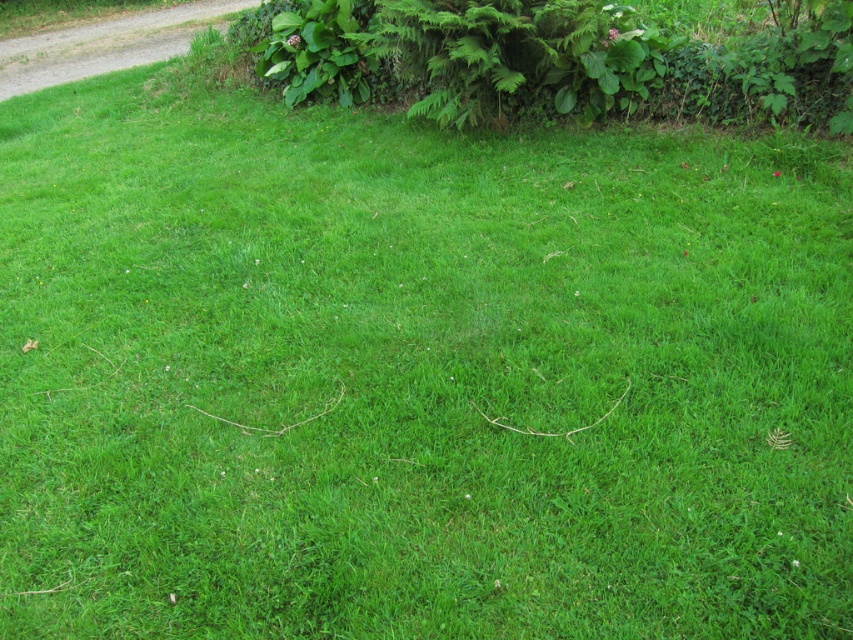
Can you confirm if green leafy hedge at upper center is shorter than gravel at upper left?

Indeed, green leafy hedge at upper center has a lesser height compared to gravel at upper left.

Who is higher up, green leafy hedge at upper center or gravel at upper left?

gravel at upper left is higher up.

Does point (430, 74) lie in front of point (47, 70)?

Yes, point (430, 74) is closer to viewer.

You are a GUI agent. You are given a task and a screenshot of the screen. Output one action in this format:
    pyautogui.click(x=<x>, y=<y>)
    Task: Click on the green leafy hedge at upper center
    The image size is (853, 640).
    Given the screenshot: What is the action you would take?
    pyautogui.click(x=550, y=61)